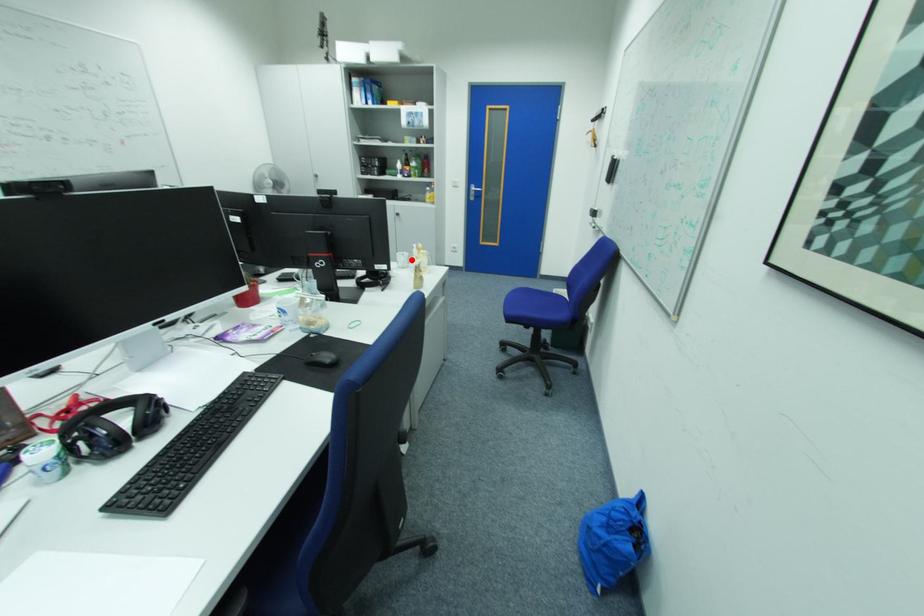
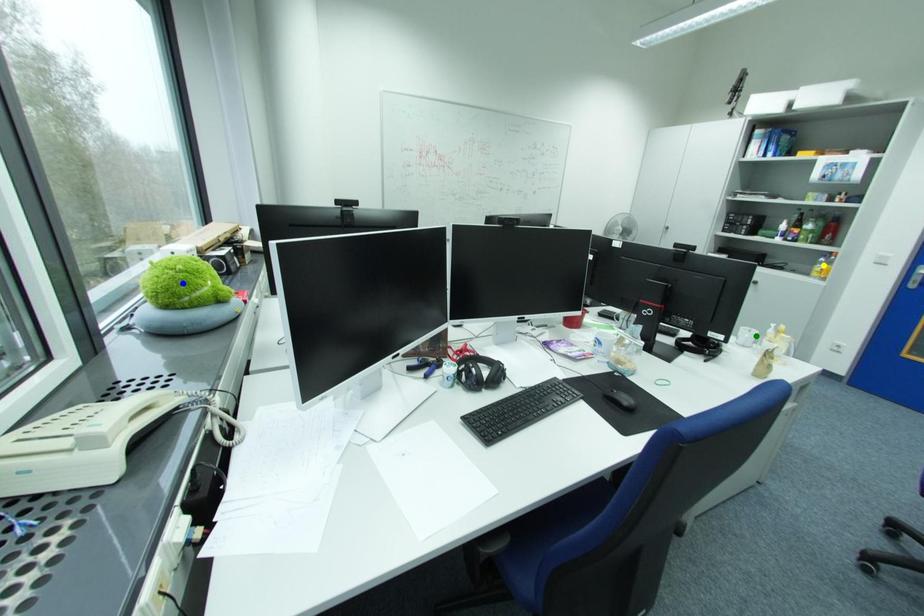
Question: I am providing you with two images of the same scene from different viewpoints. A red point is marked on the first image. You are given multiple points on the second image. Which point in image 2 represents the same 3d spot as the red point in image 1?

Choices:
 (A) blue point
 (B) yellow point
 (C) green point

Answer: (C)